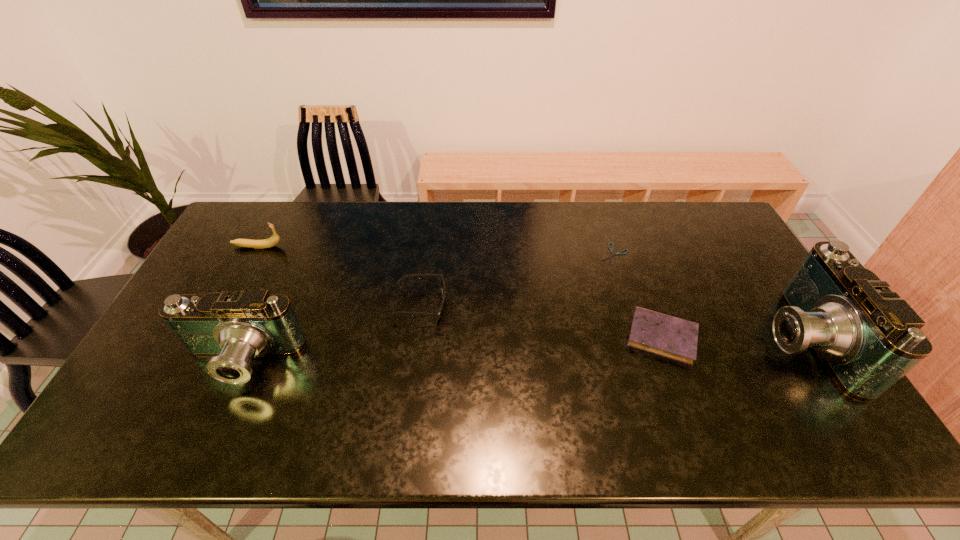
This screenshot has height=540, width=960. In order to click on object that is at the near left corner in this screenshot , I will do `click(233, 328)`.

In order to click on object that is at the near right corner in this screenshot , I will do `click(868, 338)`.

Locate an element on the screen. The height and width of the screenshot is (540, 960). free location at the far edge is located at coordinates (456, 229).

Find the location of a particular element. vacant region at the near edge of the desktop is located at coordinates (310, 405).

Find the location of a particular element. vacant space at the left edge is located at coordinates (239, 252).

Locate an element on the screen. The height and width of the screenshot is (540, 960). vacant space at the right edge of the desktop is located at coordinates (759, 353).

Find the location of a particular element. This screenshot has height=540, width=960. vacant space at the far right corner of the desktop is located at coordinates (737, 242).

Locate an element on the screen. This screenshot has width=960, height=540. vacant space that's between the shortest object and the second tallest object is located at coordinates (427, 308).

The height and width of the screenshot is (540, 960). Identify the location of free space between the rightmost object and the third tallest object. (529, 293).

The width and height of the screenshot is (960, 540). What are the coordinates of `vacant point located between the shears and the third tallest object` in the screenshot? It's located at (436, 250).